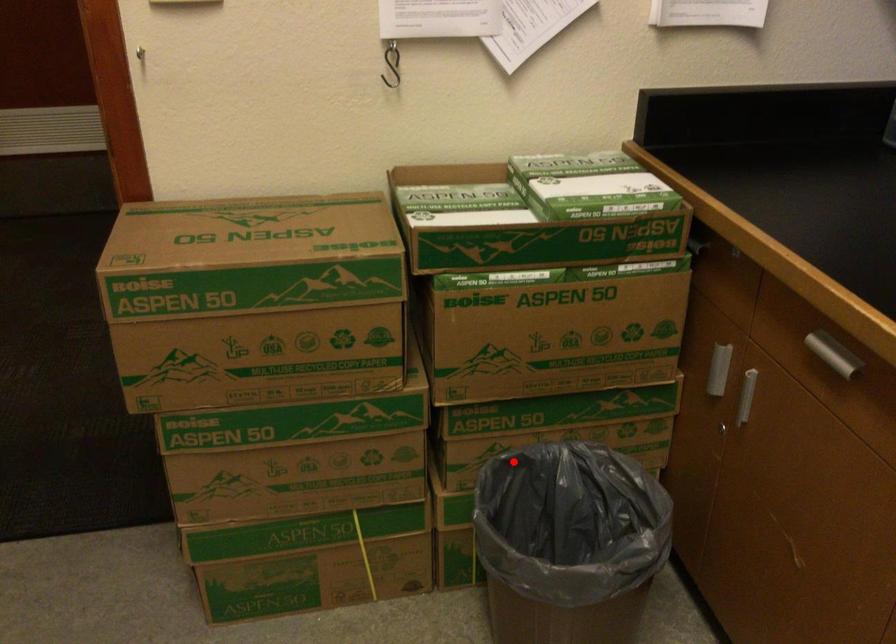
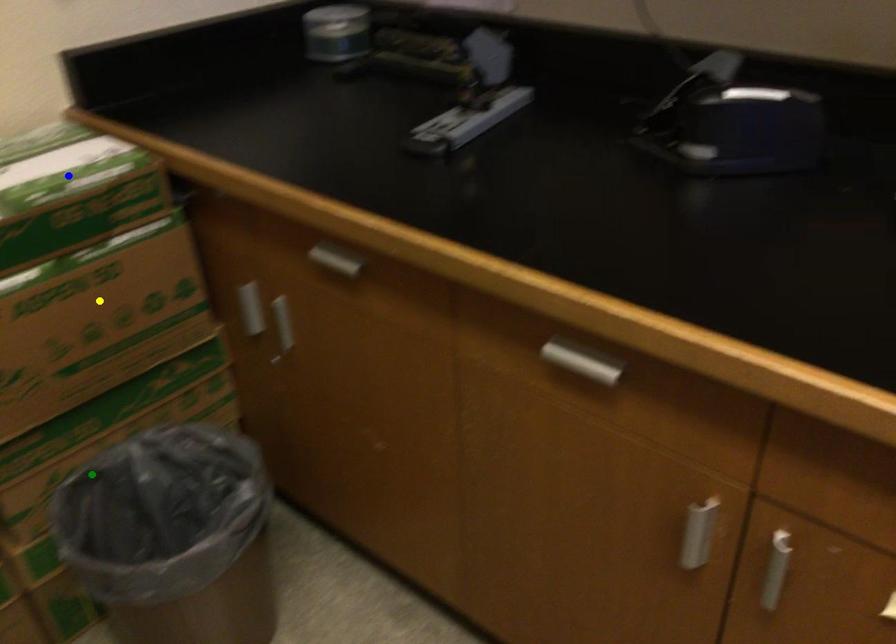
Question: I am providing you with two images of the same scene from different viewpoints. A red point is marked on the first image. You are given multiple points on the second image. Which spot in image 2 lines up with the point in image 1?

Choices:
 (A) yellow point
 (B) blue point
 (C) green point

Answer: (C)